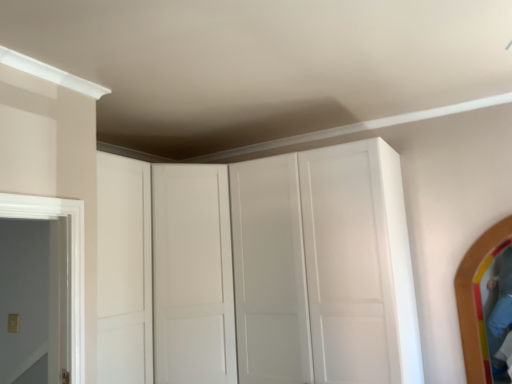
The width and height of the screenshot is (512, 384). I want to click on white matte cabinet at center, so click(257, 270).

This screenshot has width=512, height=384. Describe the element at coordinates (257, 270) in the screenshot. I see `white matte cabinet at center` at that location.

In order to click on wooden mirror at right in this screenshot , I will do `click(477, 298)`.

This screenshot has height=384, width=512. Describe the element at coordinates (477, 298) in the screenshot. I see `wooden mirror at right` at that location.

You are a GUI agent. You are given a task and a screenshot of the screen. Output one action in this format:
    pyautogui.click(x=<x>, y=<y>)
    Task: Click on the white matte cabinet at center
    This screenshot has width=512, height=384.
    Given the screenshot: What is the action you would take?
    pyautogui.click(x=257, y=270)

Is white matte cabinet at center to the left or to the right of wooden mirror at right in the image?

Clearly, white matte cabinet at center is on the left of wooden mirror at right in the image.

Which is in front, white matte cabinet at center or wooden mirror at right?

white matte cabinet at center is in front.

Considering the positions of point (269, 327) and point (465, 289), is point (269, 327) closer or farther from the camera than point (465, 289)?

Point (269, 327).

From the image's perspective, is white matte cabinet at center beneath wooden mirror at right?

No.

From a real-world perspective, which is physically below, white matte cabinet at center or wooden mirror at right?

From a 3D spatial view, wooden mirror at right is below.

Can you confirm if white matte cabinet at center is thinner than wooden mirror at right?

Incorrect, the width of white matte cabinet at center is not less than that of wooden mirror at right.

Can you confirm if white matte cabinet at center is taller than wooden mirror at right?

Indeed, white matte cabinet at center has a greater height compared to wooden mirror at right.

Considering the sizes of objects white matte cabinet at center and wooden mirror at right in the image provided, who is bigger, white matte cabinet at center or wooden mirror at right?

Bigger between the two is white matte cabinet at center.

Is white matte cabinet at center surrounding wooden mirror at right?

Definitely not — wooden mirror at right is not inside white matte cabinet at center.

From the picture: Is white matte cabinet at center positioned far away from wooden mirror at right?

white matte cabinet at center is positioned a significant distance from wooden mirror at right.

Is wooden mirror at right at the back of white matte cabinet at center?

white matte cabinet at center does not have its back to wooden mirror at right.

Can you tell me how much white matte cabinet at center and wooden mirror at right differ in facing direction?

0.000689 degrees separate the facing orientations of white matte cabinet at center and wooden mirror at right.

Where is `mirror on the right of white matte cabinet at center`? mirror on the right of white matte cabinet at center is located at coordinates (477, 298).

Which object is positioned more to the left, wooden mirror at right or white matte cabinet at center?

Positioned to the left is white matte cabinet at center.

Is wooden mirror at right closer to the viewer compared to white matte cabinet at center?

No, it is not.

Does point (477, 321) appear closer or farther from the camera than point (323, 328)?

Point (477, 321) is positioned farther from the camera compared to point (323, 328).

From the image's perspective, which object appears higher, wooden mirror at right or white matte cabinet at center?

white matte cabinet at center.

From a real-world perspective, is wooden mirror at right on white matte cabinet at center?

No, from a real-world perspective, wooden mirror at right is not on top of white matte cabinet at center.

Which of these two, wooden mirror at right or white matte cabinet at center, is wider?

Wider between the two is white matte cabinet at center.

Does wooden mirror at right have a greater height compared to white matte cabinet at center?

In fact, wooden mirror at right may be shorter than white matte cabinet at center.

Considering the sizes of objects wooden mirror at right and white matte cabinet at center in the image provided, who is bigger, wooden mirror at right or white matte cabinet at center?

Bigger between the two is white matte cabinet at center.

Is wooden mirror at right inside or outside of white matte cabinet at center?

wooden mirror at right is not inside white matte cabinet at center, it's outside.

Is wooden mirror at right positioned far away from white matte cabinet at center?

Yes, wooden mirror at right is far from white matte cabinet at center.

Based on the photo, is wooden mirror at right turned away from white matte cabinet at center?

wooden mirror at right is not turned away from white matte cabinet at center.

I want to click on dresser lying in front of the wooden mirror at right, so click(257, 270).

You are a GUI agent. You are given a task and a screenshot of the screen. Output one action in this format:
    pyautogui.click(x=<x>, y=<y>)
    Task: Click on the dresser above the wooden mirror at right (from the image's perspective)
    The height and width of the screenshot is (384, 512).
    Given the screenshot: What is the action you would take?
    pyautogui.click(x=257, y=270)

Locate an element on the screen. This screenshot has height=384, width=512. mirror that appears on the right of white matte cabinet at center is located at coordinates (477, 298).